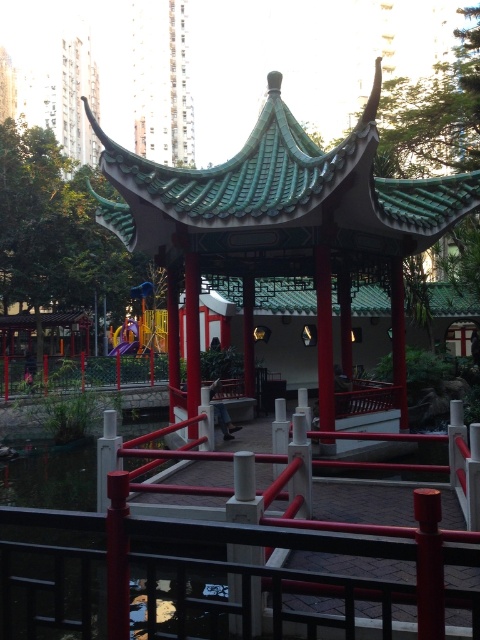
Is green glazed tile gazebo at center taller than metallic red railing at center?

Yes, green glazed tile gazebo at center is taller than metallic red railing at center.

Can you confirm if green glazed tile gazebo at center is positioned below metallic red railing at center?

No.

This screenshot has height=640, width=480. In order to click on green glazed tile gazebo at center in this screenshot , I will do `click(278, 224)`.